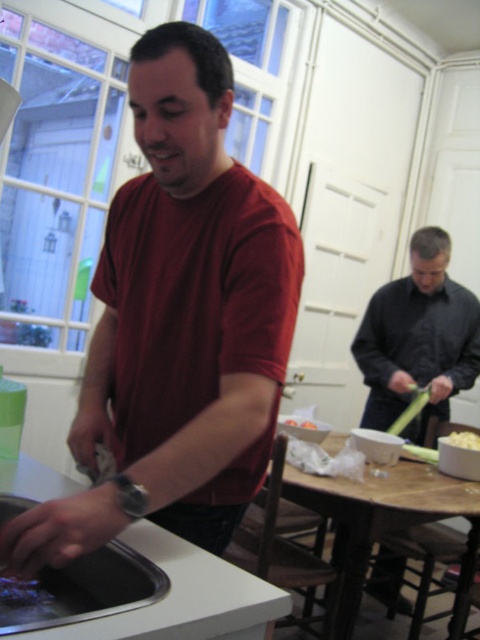
Is point (189, 388) positioned after point (442, 392)?

No, it is not.

Does matte red shirt at center come in front of dark gray shirt at right?

Yes, matte red shirt at center is in front of dark gray shirt at right.

Is point (252, 248) closer to viewer compared to point (381, 289)?

Yes, point (252, 248) is in front of point (381, 289).

This screenshot has height=640, width=480. Identify the location of matte red shirt at center. (178, 323).

From the picture: Between matte red shirt at center and white matte popcorn at center, which one has more height?

With more height is matte red shirt at center.

In order to click on matte red shirt at center in this screenshot , I will do `click(178, 323)`.

You are a GUI agent. You are given a task and a screenshot of the screen. Output one action in this format:
    pyautogui.click(x=<x>, y=<y>)
    Task: Click on the matte red shirt at center
    The image size is (480, 640).
    Given the screenshot: What is the action you would take?
    pyautogui.click(x=178, y=323)

Between point (165, 234) and point (87, 570), which one is positioned in front?

Positioned in front is point (87, 570).

Is matte red shirt at center taller than stainless steel sink at lower left?

Indeed, matte red shirt at center has a greater height compared to stainless steel sink at lower left.

Describe the element at coordinates (178, 323) in the screenshot. I see `matte red shirt at center` at that location.

Identify the location of matte red shirt at center. The image size is (480, 640). (178, 323).